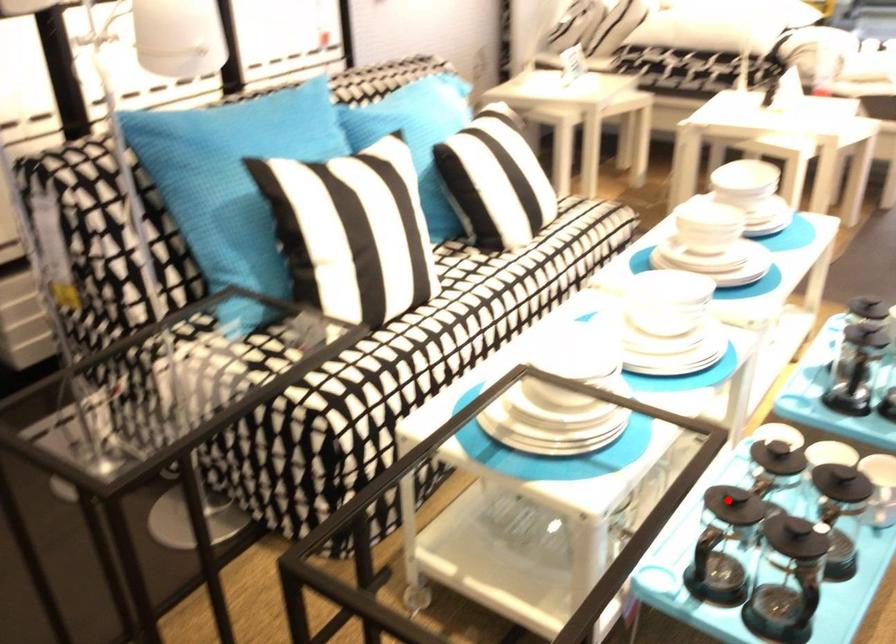
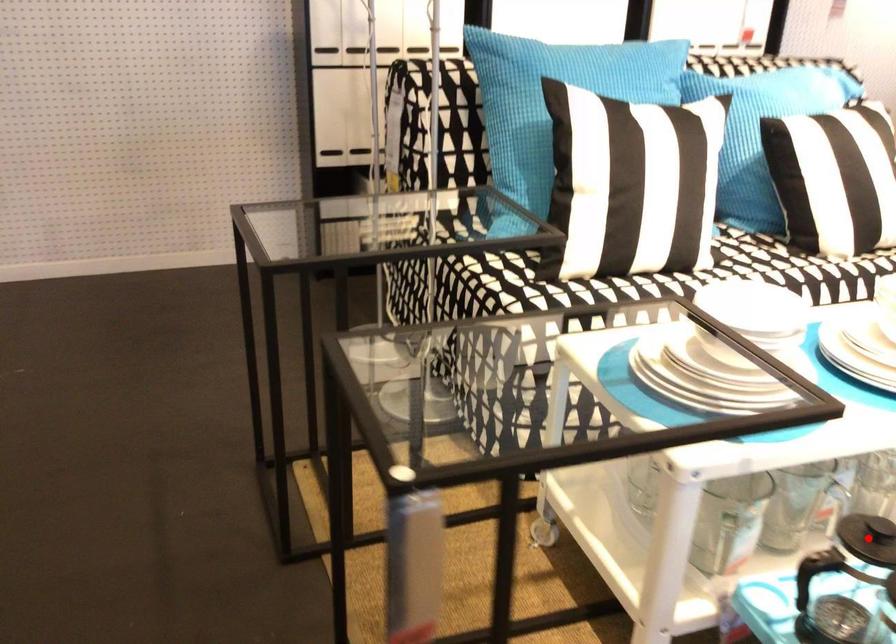
I am providing you with two images of the same scene from different viewpoints. A red point is marked on the first image and another point is marked on the second image. Are the points marked in image1 and image2 representing the same 3D position?

Yes